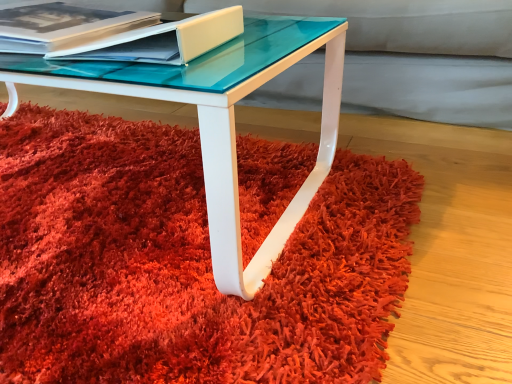
What do you see at coordinates (62, 25) in the screenshot? I see `matte white book at upper left, which ranks as the second paperback book in right-to-left order` at bounding box center [62, 25].

Where is `matte white book at upper left, marked as the first paperback book in a right-to-left arrangement`? matte white book at upper left, marked as the first paperback book in a right-to-left arrangement is located at coordinates (163, 40).

Is matte white book at upper left, the 1th paperback book viewed from the left, at the left side of matte white book at upper left, the second paperback book positioned from the left?

Indeed, matte white book at upper left, the 1th paperback book viewed from the left, is positioned on the left side of matte white book at upper left, the second paperback book positioned from the left.

Which of these two, matte white book at upper left, which ranks as the second paperback book in right-to-left order, or matte white book at upper left, marked as the first paperback book in a right-to-left arrangement, stands shorter?

Standing shorter between the two is matte white book at upper left, marked as the first paperback book in a right-to-left arrangement.

In the scene shown: Is matte white book at upper left, which ranks as the second paperback book in right-to-left order, positioned in front of matte white book at upper left, the second paperback book positioned from the left?

No, matte white book at upper left, which ranks as the second paperback book in right-to-left order, is further to the viewer.

Can you confirm if shaggy red carpet at lower center is wider than matte white book at upper left, the second paperback book positioned from the left?

Indeed, shaggy red carpet at lower center has a greater width compared to matte white book at upper left, the second paperback book positioned from the left.

Is matte white book at upper left, marked as the first paperback book in a right-to-left arrangement, surrounded by shaggy red carpet at lower center?

No, matte white book at upper left, marked as the first paperback book in a right-to-left arrangement, is located outside of shaggy red carpet at lower center.

From the picture: Is shaggy red carpet at lower center in contact with matte white book at upper left, the second paperback book positioned from the left?

They are not placed beside each other.

Considering the sizes of objects shaggy red carpet at lower center and matte white book at upper left, marked as the first paperback book in a right-to-left arrangement, in the image provided, who is smaller, shaggy red carpet at lower center or matte white book at upper left, marked as the first paperback book in a right-to-left arrangement,?

matte white book at upper left, marked as the first paperback book in a right-to-left arrangement.

From the image's perspective, between matte white book at upper left, which ranks as the second paperback book in right-to-left order, and shaggy red carpet at lower center, which one is located above?

matte white book at upper left, which ranks as the second paperback book in right-to-left order, is shown above in the image.

Does matte white book at upper left, which ranks as the second paperback book in right-to-left order, have a greater height compared to shaggy red carpet at lower center?

Yes, matte white book at upper left, which ranks as the second paperback book in right-to-left order, is taller than shaggy red carpet at lower center.

How many degrees apart are the facing directions of matte white book at upper left, the 1th paperback book viewed from the left, and shaggy red carpet at lower center?

The angle between the facing direction of matte white book at upper left, the 1th paperback book viewed from the left, and the facing direction of shaggy red carpet at lower center is 11.2 degrees.

Considering the positions of objects matte white book at upper left, which ranks as the second paperback book in right-to-left order, and shaggy red carpet at lower center in the image provided, who is more to the right, matte white book at upper left, which ranks as the second paperback book in right-to-left order, or shaggy red carpet at lower center?

From the viewer's perspective, matte white book at upper left, which ranks as the second paperback book in right-to-left order, appears more on the right side.

Which is in front, matte white book at upper left, the second paperback book positioned from the left, or shaggy red carpet at lower center?

shaggy red carpet at lower center is in front.

Where is `the 2nd paperback book to the right of the shaggy red carpet at lower center, counting from the anchor's position`? Image resolution: width=512 pixels, height=384 pixels. the 2nd paperback book to the right of the shaggy red carpet at lower center, counting from the anchor's position is located at coordinates (163, 40).

Does matte white book at upper left, marked as the first paperback book in a right-to-left arrangement, have a greater height compared to shaggy red carpet at lower center?

Yes, matte white book at upper left, marked as the first paperback book in a right-to-left arrangement, is taller than shaggy red carpet at lower center.

Could you tell me if matte white book at upper left, the second paperback book positioned from the left, is turned towards shaggy red carpet at lower center?

No, matte white book at upper left, the second paperback book positioned from the left, does not turn towards shaggy red carpet at lower center.

Is matte white book at upper left, marked as the first paperback book in a right-to-left arrangement, beside matte white book at upper left, the 1th paperback book viewed from the left?

No.

Based on the photo, from a real-world perspective, is matte white book at upper left, the second paperback book positioned from the left, positioned above or below matte white book at upper left, the 1th paperback book viewed from the left?

matte white book at upper left, the second paperback book positioned from the left, is situated higher than matte white book at upper left, the 1th paperback book viewed from the left, in the real world.

Between matte white book at upper left, the second paperback book positioned from the left, and matte white book at upper left, which ranks as the second paperback book in right-to-left order, which one has less height?

matte white book at upper left, the second paperback book positioned from the left, is shorter.

Is matte white book at upper left, the second paperback book positioned from the left, facing towards matte white book at upper left, the 1th paperback book viewed from the left?

No, matte white book at upper left, the second paperback book positioned from the left, is not facing towards matte white book at upper left, the 1th paperback book viewed from the left.

How far apart are shaggy red carpet at lower center and matte white book at upper left, which ranks as the second paperback book in right-to-left order?

shaggy red carpet at lower center is 14.63 inches from matte white book at upper left, which ranks as the second paperback book in right-to-left order.

Does shaggy red carpet at lower center have a greater height compared to matte white book at upper left, the 1th paperback book viewed from the left?

In fact, shaggy red carpet at lower center may be shorter than matte white book at upper left, the 1th paperback book viewed from the left.

You are a GUI agent. You are given a task and a screenshot of the screen. Output one action in this format:
    pyautogui.click(x=<x>, y=<y>)
    Task: Click on the 1st paperback book to the right when counting from the shaggy red carpet at lower center
    This screenshot has height=384, width=512.
    Given the screenshot: What is the action you would take?
    pyautogui.click(x=62, y=25)

Is matte white book at upper left, the 1th paperback book viewed from the left, at the back of shaggy red carpet at lower center?

shaggy red carpet at lower center does not have its back to matte white book at upper left, the 1th paperback book viewed from the left.

Identify the location of paperback book located on the left of matte white book at upper left, the second paperback book positioned from the left. (62, 25).

In order to click on mat that is under the matte white book at upper left, marked as the first paperback book in a right-to-left arrangement (from a real-world perspective) in this screenshot , I will do `click(184, 263)`.

Based on their spatial positions, is shaggy red carpet at lower center or matte white book at upper left, which ranks as the second paperback book in right-to-left order, closer to matte white book at upper left, the second paperback book positioned from the left?

matte white book at upper left, which ranks as the second paperback book in right-to-left order, lies closer to matte white book at upper left, the second paperback book positioned from the left, than the other object.

From the image, which object appears to be nearer to matte white book at upper left, marked as the first paperback book in a right-to-left arrangement, matte white book at upper left, the 1th paperback book viewed from the left, or shaggy red carpet at lower center?

Based on the image, matte white book at upper left, the 1th paperback book viewed from the left, appears to be nearer to matte white book at upper left, marked as the first paperback book in a right-to-left arrangement.

Looking at the image, which one is located further to shaggy red carpet at lower center, matte white book at upper left, marked as the first paperback book in a right-to-left arrangement, or matte white book at upper left, the 1th paperback book viewed from the left?

Among the two, matte white book at upper left, the 1th paperback book viewed from the left, is located further to shaggy red carpet at lower center.

Looking at the image, which one is located further to matte white book at upper left, the 1th paperback book viewed from the left, matte white book at upper left, marked as the first paperback book in a right-to-left arrangement, or shaggy red carpet at lower center?

shaggy red carpet at lower center.

Considering their positions, is matte white book at upper left, which ranks as the second paperback book in right-to-left order, positioned closer to shaggy red carpet at lower center than matte white book at upper left, the second paperback book positioned from the left?

Based on the image, matte white book at upper left, the second paperback book positioned from the left, appears to be nearer to shaggy red carpet at lower center.

Based on their spatial positions, is shaggy red carpet at lower center or matte white book at upper left, the second paperback book positioned from the left, closer to matte white book at upper left, which ranks as the second paperback book in right-to-left order?

matte white book at upper left, the second paperback book positioned from the left, lies closer to matte white book at upper left, which ranks as the second paperback book in right-to-left order, than the other object.

The width and height of the screenshot is (512, 384). Find the location of `paperback book between matte white book at upper left, the 1th paperback book viewed from the left, and shaggy red carpet at lower center vertically`. paperback book between matte white book at upper left, the 1th paperback book viewed from the left, and shaggy red carpet at lower center vertically is located at coordinates (163, 40).